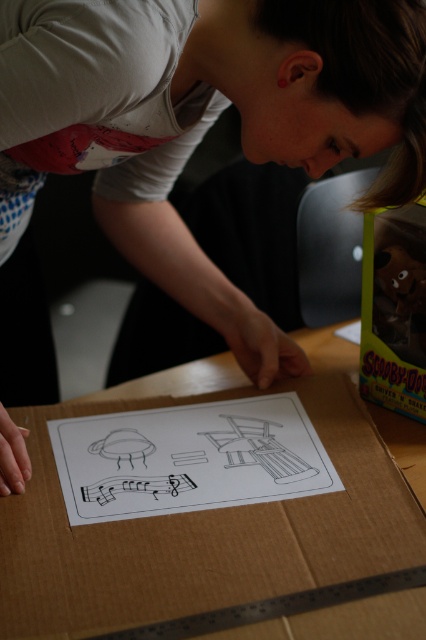
Question: Can you confirm if brown cardboard box at center is positioned to the left of translucent plastic toy at upper right?

Choices:
 (A) yes
 (B) no

Answer: (A)

Question: Is brown cardboard box at center positioned at the back of translucent plastic toy at upper right?

Choices:
 (A) no
 (B) yes

Answer: (A)

Question: Which object is closer to the camera taking this photo?

Choices:
 (A) brown cardboard box at center
 (B) translucent plastic toy at upper right

Answer: (A)

Question: Which point appears farthest from the camera in this image?

Choices:
 (A) (382, 288)
 (B) (77, 408)

Answer: (A)

Question: Considering the relative positions of brown cardboard box at center and translucent plastic toy at upper right in the image provided, where is brown cardboard box at center located with respect to translucent plastic toy at upper right?

Choices:
 (A) above
 (B) below

Answer: (B)